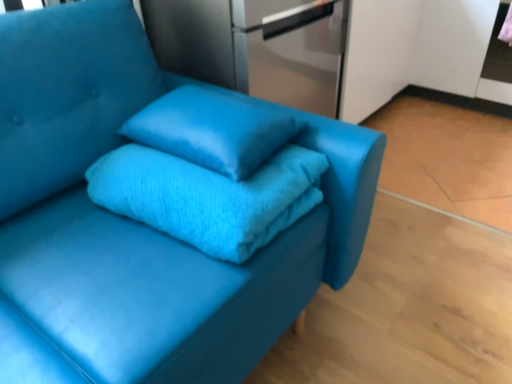
Question: From the image's perspective, is turquoise fuzzy bath towel at center located above or below satin silver refrigerator at upper center?

Choices:
 (A) above
 (B) below

Answer: (B)

Question: From a real-world perspective, relative to satin silver refrigerator at upper center, is turquoise fuzzy bath towel at center vertically above or below?

Choices:
 (A) below
 (B) above

Answer: (A)

Question: Which of these objects is positioned farthest from the matte blue pillow at center?

Choices:
 (A) satin silver refrigerator at upper center
 (B) turquoise fuzzy bath towel at center

Answer: (A)

Question: Estimate the real-world distances between objects in this image. Which object is farther from the matte blue pillow at center?

Choices:
 (A) turquoise fuzzy bath towel at center
 (B) satin silver refrigerator at upper center

Answer: (B)